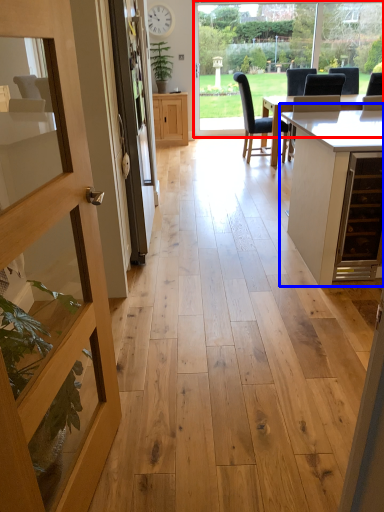
Question: Among these objects, which one is farthest to the camera, window frame (highlighted by a red box) or table (highlighted by a blue box)?

Choices:
 (A) window frame
 (B) table

Answer: (A)